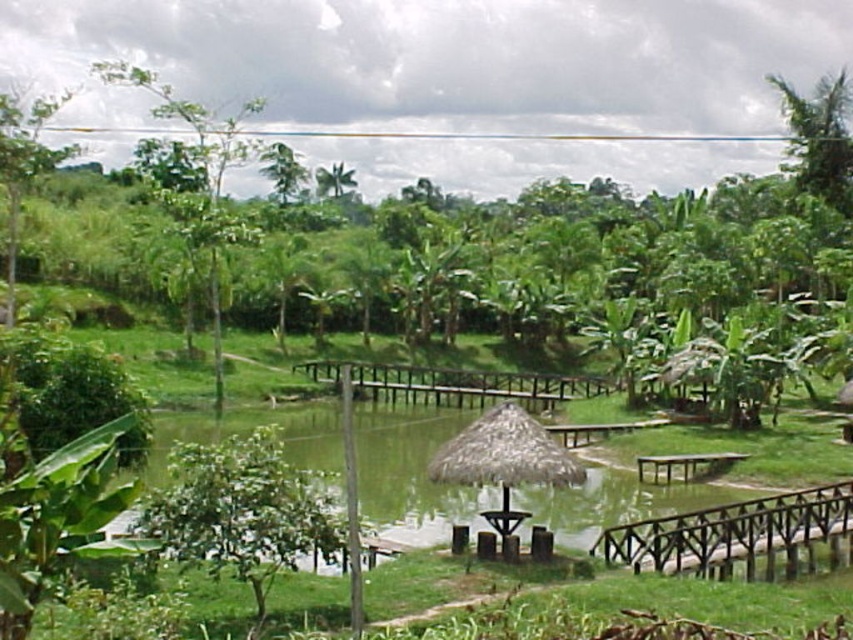
You are planning to set up a small tent for a picnic near the brown wooden bridge at lower right and the green wooden picnic table at lower right. Which object is shorter and therefore safer to place the tent near to avoid blocking the view of taller structures?

The brown wooden bridge at lower right has a lesser height compared to the green wooden picnic table at lower right, so it is safer to place the tent near the brown wooden bridge at lower right to avoid blocking the view of taller structures.

You are planning to install a bird feeder in this tropical landscape. The bird feeder requires a tall structure to be placed on. Which object between the green leafy tree at left and the green leafy palm at upper center would be more suitable for placing the bird feeder?

The green leafy tree at left is taller than the green leafy palm at upper center, so it would be more suitable for placing the bird feeder as it provides a taller structure.

You are a tourist standing at the entrance of the thatched pavilion and want to reach the green wooden picnic table at lower right. The brown wooden bridge at lower right is in your path. Can you walk directly to the picnic table without crossing the bridge?

The brown wooden bridge at lower right is in front of the green wooden picnic table at lower right, so you must cross the bridge to reach the picnic table.